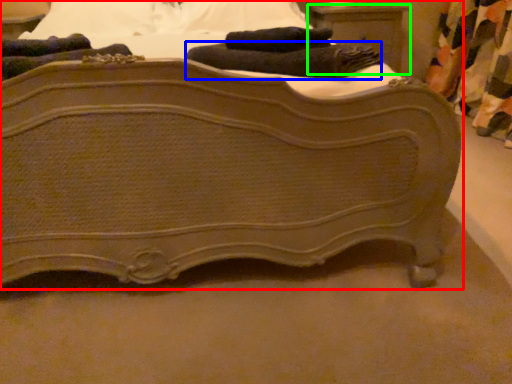
Question: Based on their relative distances, which object is farther from bed (highlighted by a red box)? Choose from bath towel (highlighted by a blue box) and nightstand (highlighted by a green box).

Choices:
 (A) bath towel
 (B) nightstand

Answer: (B)